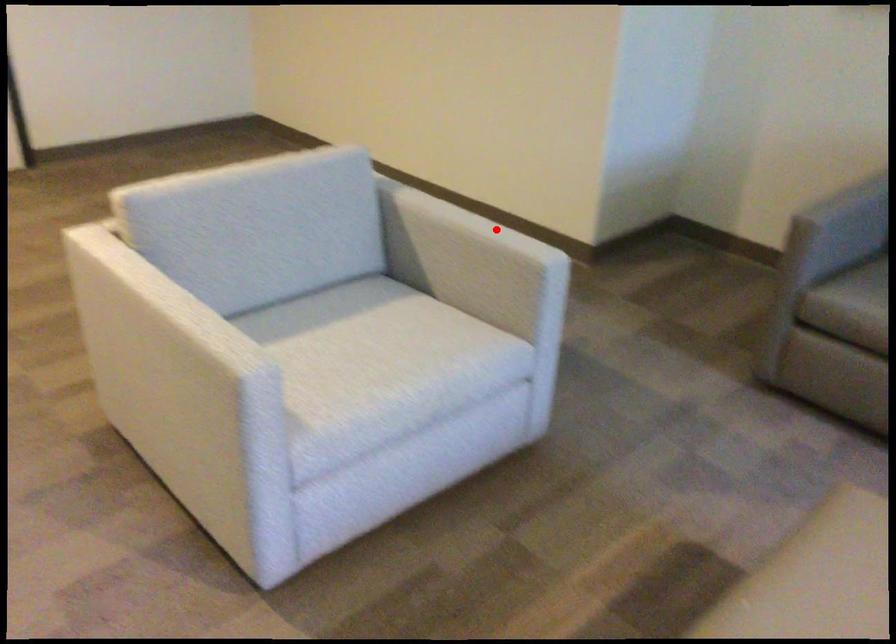
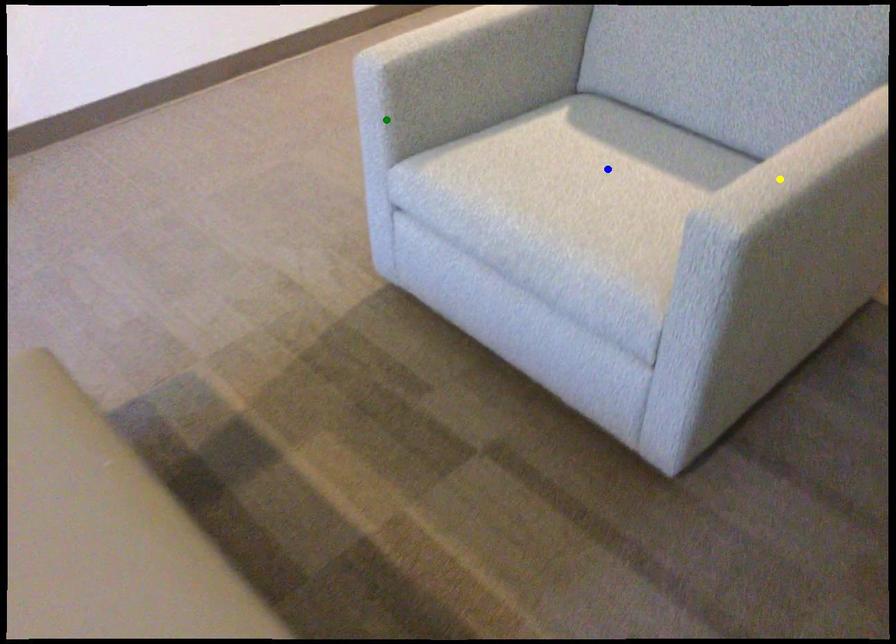
Question: I am providing you with two images of the same scene from different viewpoints. A red point is marked on the first image. You are given multiple points on the second image. Which spot in image 2 lines up with the point in image 1?

Choices:
 (A) yellow point
 (B) green point
 (C) blue point

Answer: (A)